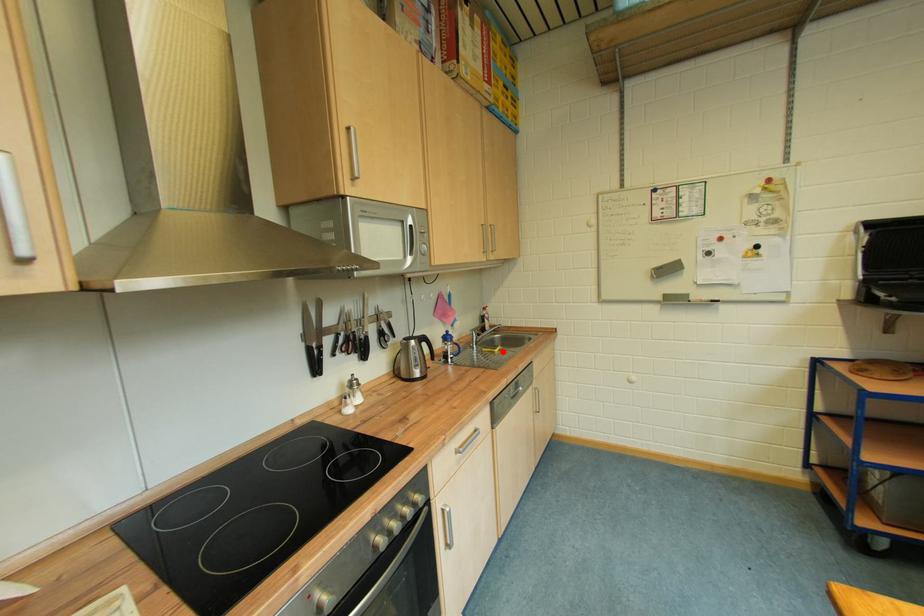
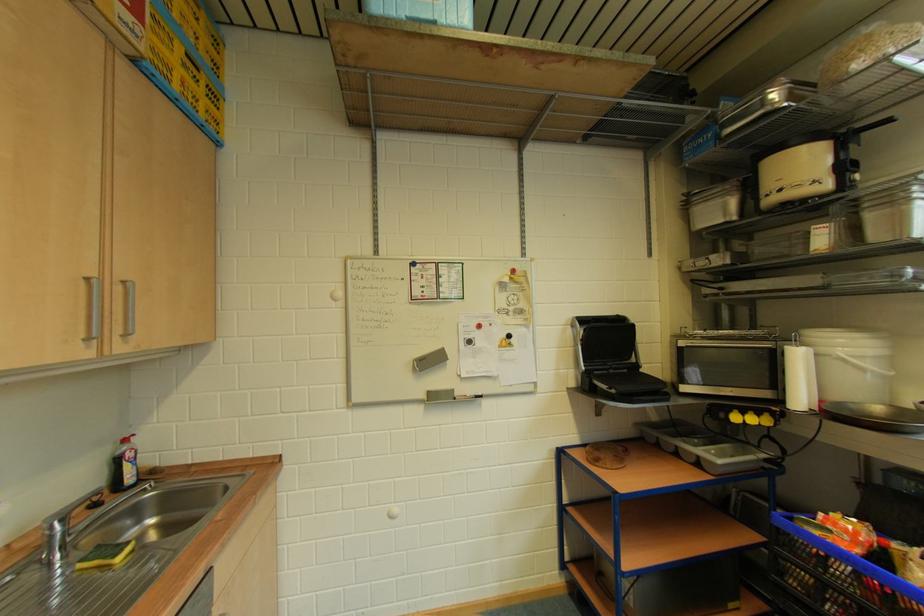
In the second image, find the point that corresponds to the highlighted location in the first image.

(124, 559)